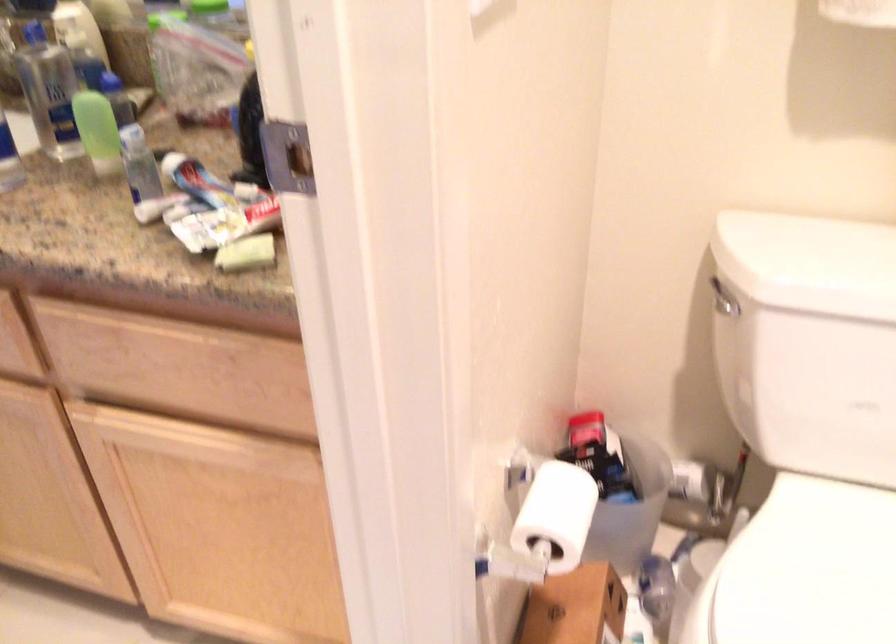
The image size is (896, 644). What do you see at coordinates (197, 182) in the screenshot? I see `the toothpaste tube` at bounding box center [197, 182].